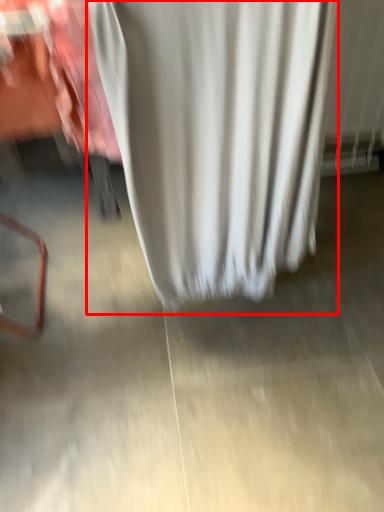
Question: From the image's perspective, considering the relative positions of curtain (annotated by the red box) and concrete in the image provided, where is curtain (annotated by the red box) located with respect to the staircase?

Choices:
 (A) below
 (B) above

Answer: (B)